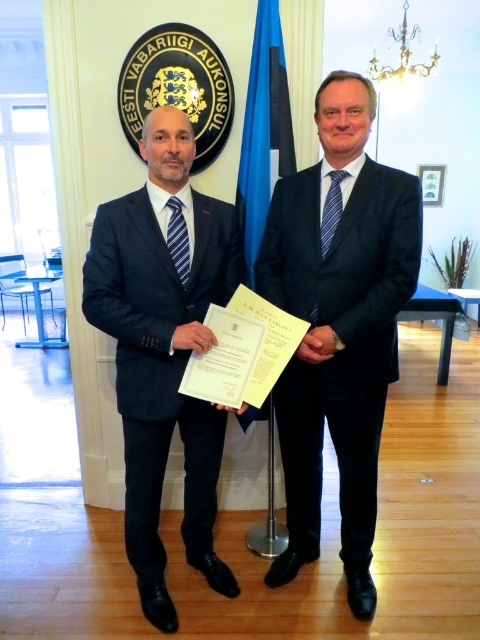
Question: Among these points, which one is farthest from the camera?

Choices:
 (A) (188, 433)
 (B) (303, 346)

Answer: (A)

Question: Is dark blue suit at center to the left of matte black suit at center from the viewer's perspective?

Choices:
 (A) yes
 (B) no

Answer: (B)

Question: Can you confirm if dark blue suit at center is positioned to the right of matte black suit at center?

Choices:
 (A) no
 (B) yes

Answer: (B)

Question: Which point is farther from the camera taking this photo?

Choices:
 (A) (374, 307)
 (B) (92, 305)

Answer: (A)

Question: In this image, where is dark blue suit at center located relative to matte black suit at center?

Choices:
 (A) right
 (B) left

Answer: (A)